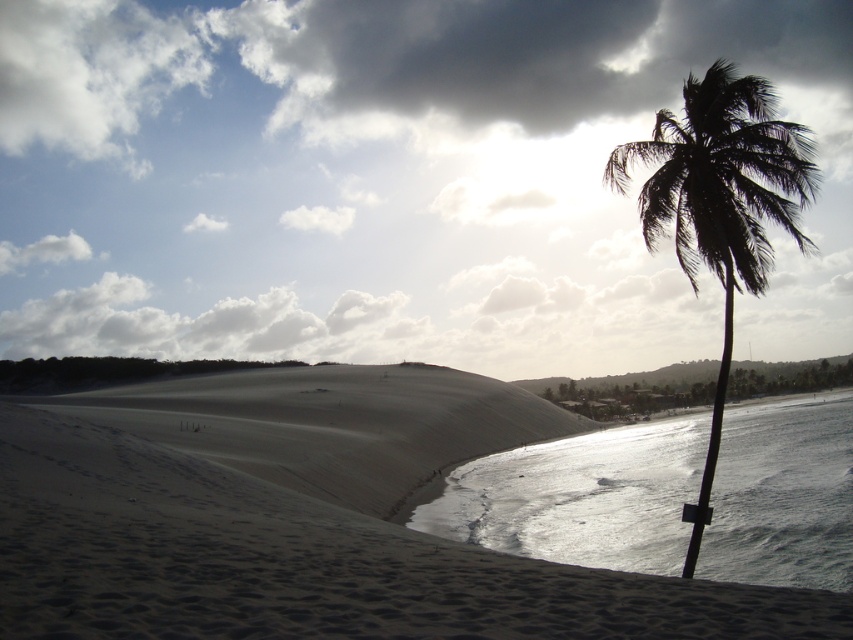
Question: Which object is closer to the camera taking this photo?

Choices:
 (A) glistening silver water at beach right
 (B) sandy at lower left

Answer: (B)

Question: Does sandy at lower left appear on the right side of silhouette leafy palm at right?

Choices:
 (A) no
 (B) yes

Answer: (A)

Question: Which object is the farthest from the glistening silver water at beach right?

Choices:
 (A) sandy at lower left
 (B) silhouette leafy palm at right
 (C) sandy beige dune at center

Answer: (A)

Question: Which point appears farthest from the camera in this image?

Choices:
 (A) (715, 388)
 (B) (148, 417)
 (C) (785, 541)
 (D) (27, 426)

Answer: (A)

Question: Is glistening silver water at beach right to the right of silhouette leafy palm at right from the viewer's perspective?

Choices:
 (A) no
 (B) yes

Answer: (A)

Question: Is sandy beige dune at center below silhouette leafy palm at right?

Choices:
 (A) no
 (B) yes

Answer: (B)